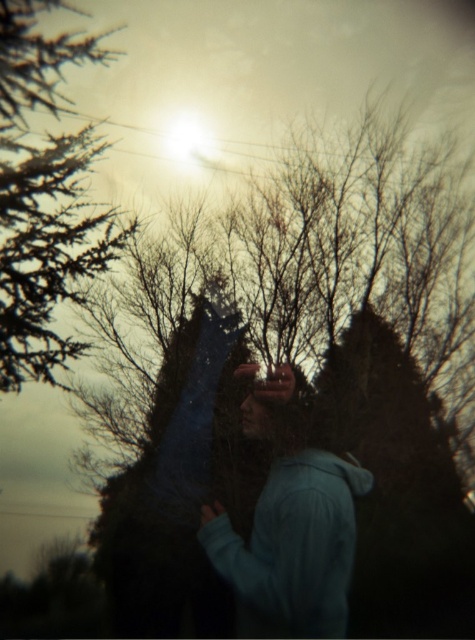
How far apart are green needle-like at left and blue fleece jacket at center?

green needle-like at left is 2.30 meters away from blue fleece jacket at center.

Looking at this image, can you confirm if green needle-like at left is positioned below blue fleece jacket at center?

No, green needle-like at left is not below blue fleece jacket at center.

Is point (63, 180) positioned in front of point (332, 557)?

No, (63, 180) is further to viewer.

Locate an element on the screen. green needle-like at left is located at coordinates [44, 196].